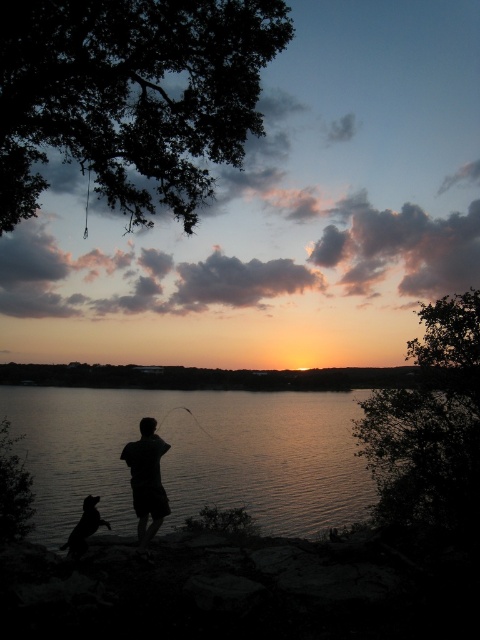
Question: Considering the real-world distances, which object is farthest from the black matte fisherman at center?

Choices:
 (A) silvery reflective water at center
 (B) silhouette fur dog at lower left

Answer: (A)

Question: Is black matte fisherman at center to the left of silhouette fur dog at lower left from the viewer's perspective?

Choices:
 (A) yes
 (B) no

Answer: (B)

Question: Which of the following is the farthest from the observer?

Choices:
 (A) silhouette fur dog at lower left
 (B) silvery reflective water at center

Answer: (B)

Question: Does silvery reflective water at center have a lesser width compared to silhouette fur dog at lower left?

Choices:
 (A) yes
 (B) no

Answer: (B)

Question: Which object is closer to the camera taking this photo?

Choices:
 (A) silvery reflective water at center
 (B) black matte fisherman at center

Answer: (B)

Question: Does silvery reflective water at center appear on the right side of black matte fisherman at center?

Choices:
 (A) yes
 (B) no

Answer: (B)